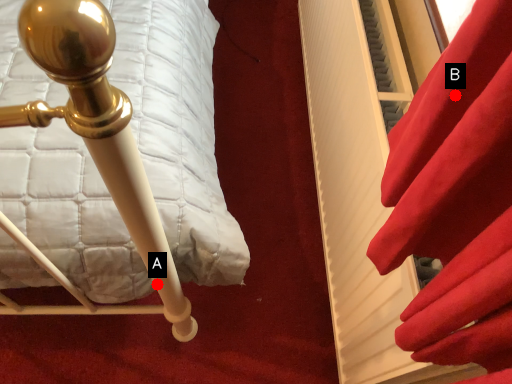
Question: Two points are circled on the image, labeled by A and B beside each circle. Which of the following is the farthest from the observer?

Choices:
 (A) A is further
 (B) B is further

Answer: (A)